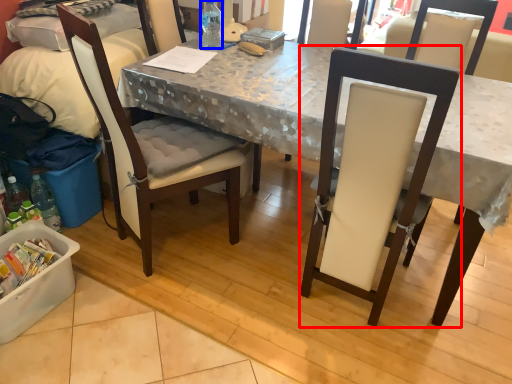
Question: Which of the following is the farthest to the observer, chair (highlighted by a red box) or bottle (highlighted by a blue box)?

Choices:
 (A) chair
 (B) bottle

Answer: (B)